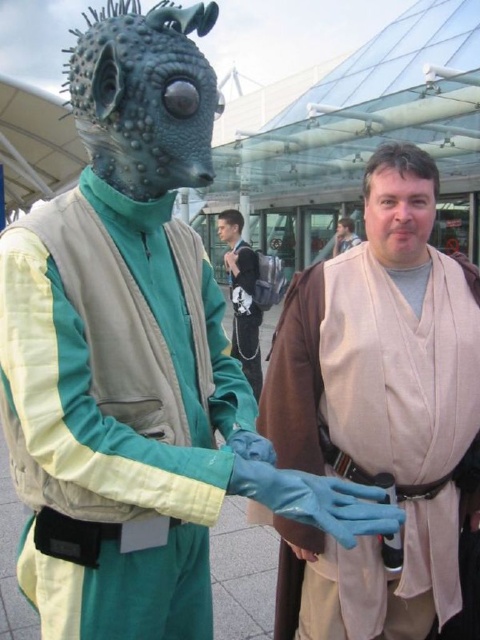
What do you see at coordinates (380, 412) in the screenshot? I see `beige fabric robe at center` at bounding box center [380, 412].

Is point (389, 614) positioned in front of point (252, 320)?

Yes, it is in front of point (252, 320).

Find the location of a particular element. beige fabric robe at center is located at coordinates (380, 412).

Between point (160, 468) and point (254, 282), which one is positioned behind?

Point (254, 282)

Between point (41, 444) and point (240, 284), which one is positioned in front?

Point (41, 444) is in front.

Find the location of `green matte vest at center`. green matte vest at center is located at coordinates (112, 420).

Can you confirm if beige fabric robe at center is positioned below green matte vest at center?

Correct, beige fabric robe at center is located below green matte vest at center.

Can you confirm if beige fabric robe at center is positioned to the left of green matte vest at center?

In fact, beige fabric robe at center is to the right of green matte vest at center.

Which is behind, point (320, 573) or point (188, 390)?

The point (320, 573) is more distant.

Locate an element on the screen. The image size is (480, 640). beige fabric robe at center is located at coordinates (380, 412).